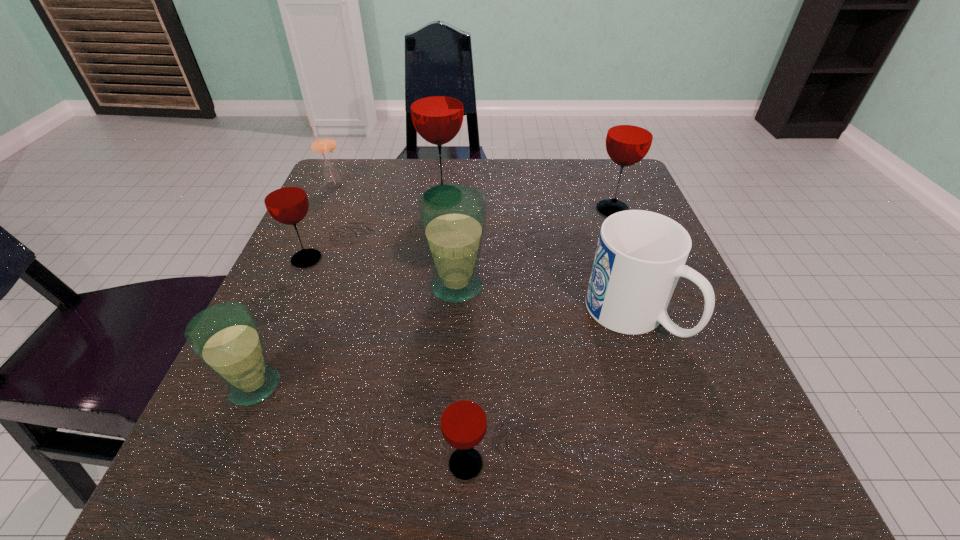
This screenshot has width=960, height=540. What are the coordinates of `free point between the nearest glass and the leftmost red glass` in the screenshot? It's located at (386, 362).

At what (x,y) coordinates should I click in order to perform the action: click on free space between the nearer blue glass and the straw. Please return your answer as a coordinate pair (x, y). This screenshot has width=960, height=540. Looking at the image, I should click on (294, 286).

Locate an element on the screen. The height and width of the screenshot is (540, 960). vacant area between the mug and the farther blue glass is located at coordinates (544, 300).

Identify the location of vacant point located between the bigger blue glass and the straw. (395, 236).

Identify the location of vacant area between the third biggest red glass and the bigger blue glass. The height and width of the screenshot is (540, 960). pyautogui.click(x=381, y=273).

Where is `the third closest object to the smaller blue glass`? the third closest object to the smaller blue glass is located at coordinates (463, 420).

Identify which object is the nearest to the nearer blue glass. Please provide its 2D coordinates. Your answer should be formatted as a tuple, i.e. [(x, y)], where the tuple contains the x and y coordinates of a point satisfying the conditions above.

[(286, 201)]

You are a GUI agent. You are given a task and a screenshot of the screen. Output one action in this format:
    pyautogui.click(x=<x>, y=<y>)
    Task: Click on the glass that stands as the closest to the left blue glass
    
    Given the screenshot: What is the action you would take?
    pyautogui.click(x=286, y=201)

Identify which glass is located as the fifth nearest to the straw. Please provide its 2D coordinates. Your answer should be formatted as a tuple, i.e. [(x, y)], where the tuple contains the x and y coordinates of a point satisfying the conditions above.

[(629, 137)]

Select which red glass is the second closest to the tallest glass. Please provide its 2D coordinates. Your answer should be formatted as a tuple, i.e. [(x, y)], where the tuple contains the x and y coordinates of a point satisfying the conditions above.

[(629, 137)]